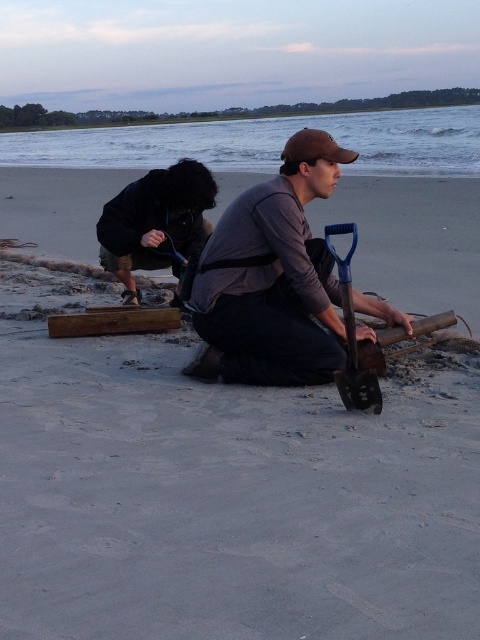
Question: Does smooth sand shovel at center appear under matte gray shirt at center?

Choices:
 (A) yes
 (B) no

Answer: (B)

Question: Which object is positioned farthest from the matte gray shirt at center?

Choices:
 (A) blue plastic shovel at center
 (B) smooth sand shovel at center

Answer: (B)

Question: Which of the following is the closest to the observer?

Choices:
 (A) brown wood at lower center
 (B) blue plastic shovel at center

Answer: (B)

Question: Is smooth sand shovel at center thinner than blue plastic shovel at center?

Choices:
 (A) yes
 (B) no

Answer: (B)

Question: Observing the image, what is the correct spatial positioning of black fabric bag at left in reference to brown wood at lower center?

Choices:
 (A) above
 (B) below

Answer: (A)

Question: Which of the following is the farthest from the observer?

Choices:
 (A) (230, 349)
 (B) (408, 232)
 (C) (325, 237)

Answer: (B)